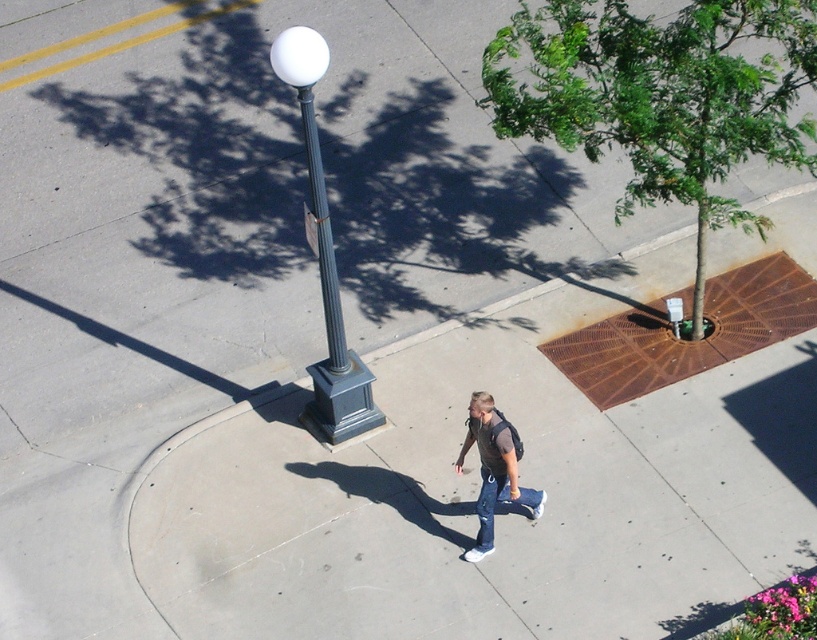
Question: Which point appears closest to the camera in this image?

Choices:
 (A) (485, 538)
 (B) (322, 225)
 (C) (470, 552)

Answer: (B)

Question: Does white glossy ball at center have a smaller size compared to metallic gray pole at center?

Choices:
 (A) yes
 (B) no

Answer: (B)

Question: Can you confirm if white glossy ball at center is smaller than denim at center?

Choices:
 (A) no
 (B) yes

Answer: (A)

Question: Among these objects, which one is nearest to the camera?

Choices:
 (A) metallic gray pole at center
 (B) white glossy ball at center

Answer: (B)

Question: Which object is closer to the camera taking this photo?

Choices:
 (A) white glossy ball at center
 (B) denim at center

Answer: (A)

Question: Is denim jeans at center further to the viewer compared to denim at center?

Choices:
 (A) no
 (B) yes

Answer: (A)